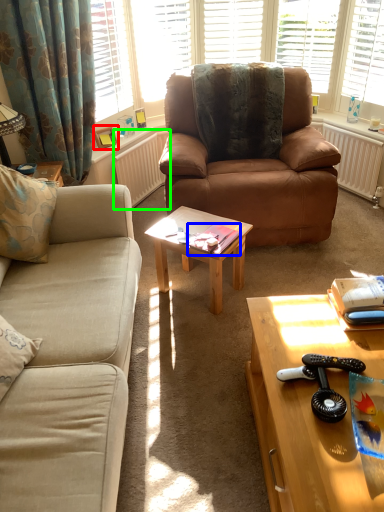
Question: Considering the real-world distances, which object is farthest from picture frame (highlighted by a red box)? book (highlighted by a blue box) or radiator (highlighted by a green box)?

Choices:
 (A) book
 (B) radiator

Answer: (A)